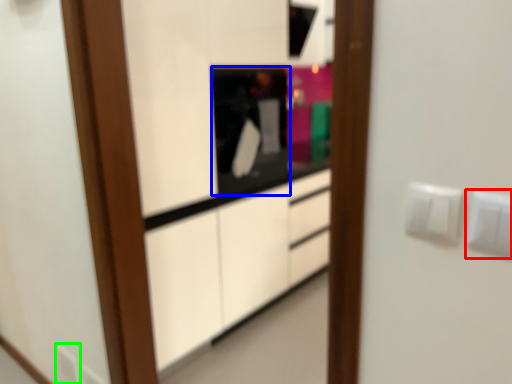
Question: Considering the real-world distances, which object is closest to electric outlet (highlighted by a red box)? appliance (highlighted by a blue box) or electric outlet (highlighted by a green box).

Choices:
 (A) appliance
 (B) electric outlet

Answer: (A)